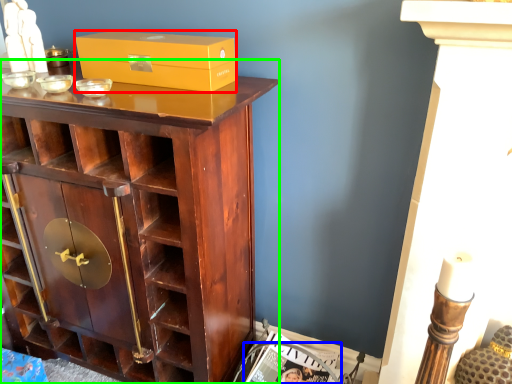
Question: Considering the real-world distances, which object is farthest from box (highlighted by a red box)? magazine (highlighted by a blue box) or cupboard (highlighted by a green box)?

Choices:
 (A) magazine
 (B) cupboard

Answer: (A)